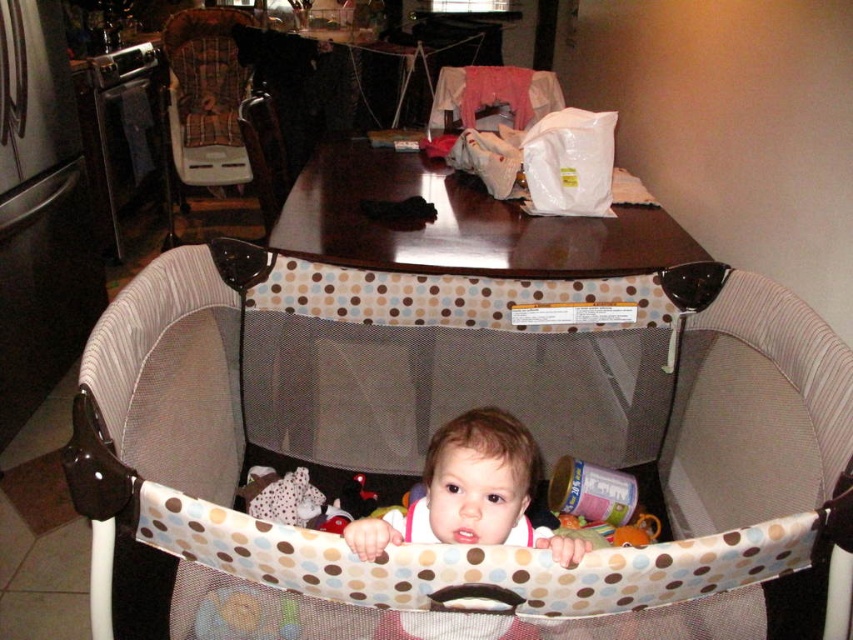
In the scene shown: How distant is plaid fabric highchair at left from wooden chair at center?

A distance of 3.36 feet exists between plaid fabric highchair at left and wooden chair at center.

Does plaid fabric highchair at left have a lesser height compared to wooden chair at center?

In fact, plaid fabric highchair at left may be taller than wooden chair at center.

Is point (210, 68) farther from camera compared to point (263, 108)?

Yes, it is behind point (263, 108).

At what (x,y) coordinates should I click in order to perform the action: click on plaid fabric highchair at left. Please return your answer as a coordinate pair (x, y). The image size is (853, 640). Looking at the image, I should click on (218, 113).

Is polka dot fabric playpen at center smaller than wooden chair at center?

No, polka dot fabric playpen at center is not smaller than wooden chair at center.

Is polka dot fabric playpen at center above wooden chair at center?

Incorrect, polka dot fabric playpen at center is not positioned above wooden chair at center.

You are a GUI agent. You are given a task and a screenshot of the screen. Output one action in this format:
    pyautogui.click(x=<x>, y=<y>)
    Task: Click on the polka dot fabric playpen at center
    Image resolution: width=853 pixels, height=640 pixels.
    Given the screenshot: What is the action you would take?
    pyautogui.click(x=422, y=451)

Who is lower down, plaid fabric highchair at left or smooth beige baby playpen at center?

smooth beige baby playpen at center is below.

Can you confirm if plaid fabric highchair at left is positioned to the left of smooth beige baby playpen at center?

Yes, plaid fabric highchair at left is to the left of smooth beige baby playpen at center.

Is point (270, 115) positioned before point (398, 515)?

No, it is behind (398, 515).

This screenshot has width=853, height=640. What are the coordinates of `plaid fabric highchair at left` in the screenshot? It's located at (218, 113).